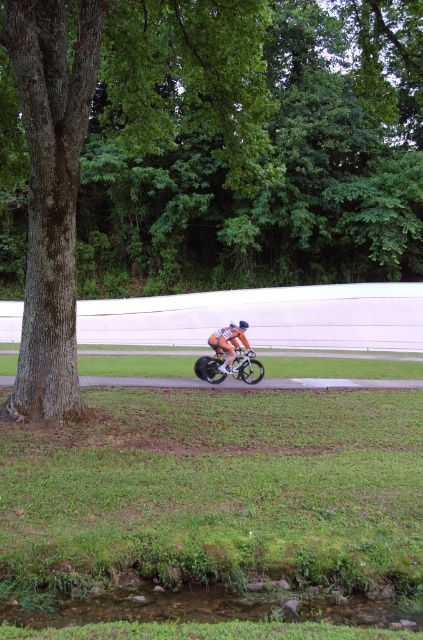
Does shiny metallic bicycle at center have a greater height compared to orange reflective suit at center?

In fact, shiny metallic bicycle at center may be shorter than orange reflective suit at center.

Is the position of shiny metallic bicycle at center more distant than that of orange reflective suit at center?

Yes, shiny metallic bicycle at center is further from the viewer.

Who is more forward, (242, 369) or (224, 333)?

Point (242, 369) is in front.

Locate an element on the screen. shiny metallic bicycle at center is located at coordinates (247, 365).

Is point (46, 212) positioned before point (202, 369)?

That is True.

Which is behind, point (107, 86) or point (208, 358)?

Point (107, 86)

Image resolution: width=423 pixels, height=640 pixels. In order to click on green rough bark tree at left in this screenshot , I will do `click(118, 134)`.

Where is `green rough bark tree at left`? The width and height of the screenshot is (423, 640). green rough bark tree at left is located at coordinates (118, 134).

Measure the distance from green rough bark tree at left to orange reflective suit at center.

The distance of green rough bark tree at left from orange reflective suit at center is 7.96 meters.

Is green rough bark tree at left wider than orange reflective suit at center?

Correct, the width of green rough bark tree at left exceeds that of orange reflective suit at center.

Identify the location of green rough bark tree at left. (118, 134).